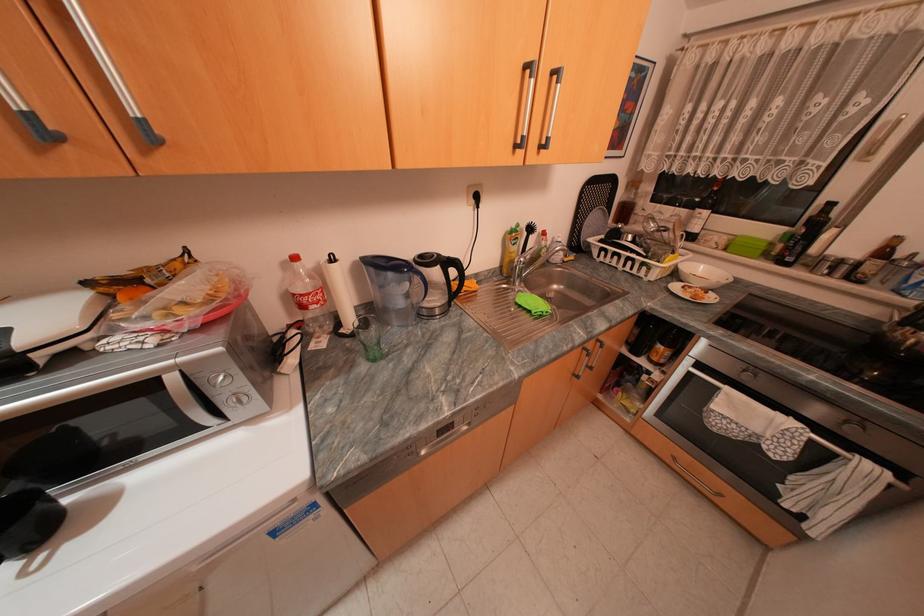
The height and width of the screenshot is (616, 924). Describe the element at coordinates (714, 382) in the screenshot. I see `the microwave door handle` at that location.